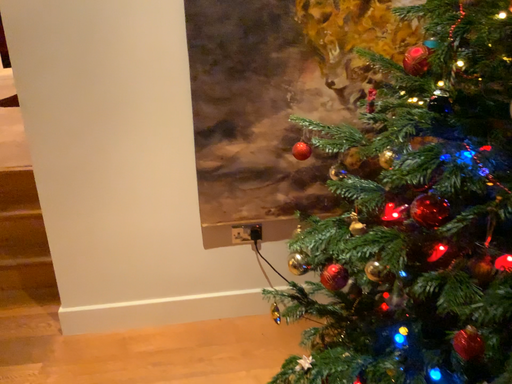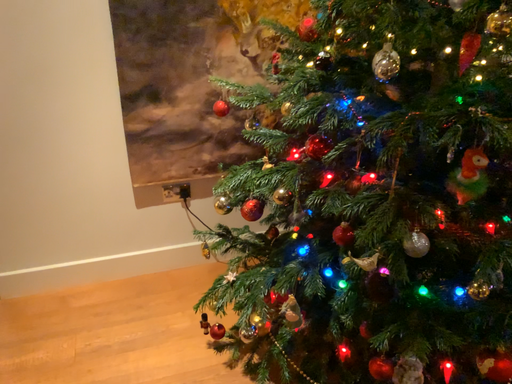
Question: How did the camera likely rotate when shooting the video?

Choices:
 (A) rotated right
 (B) rotated left

Answer: (A)